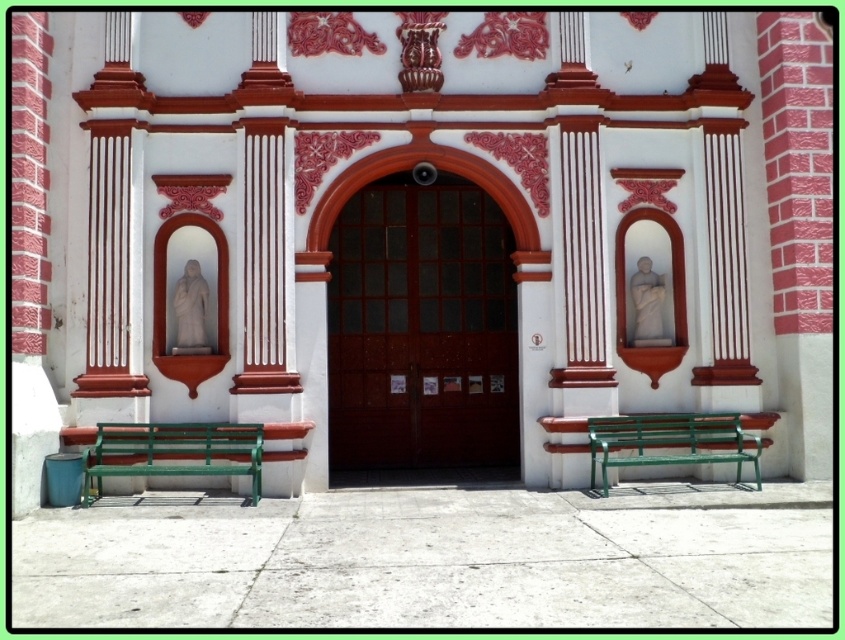
Does green painted wood bench at lower left have a smaller size compared to green metal bench at lower right?

Yes, green painted wood bench at lower left is smaller than green metal bench at lower right.

Does point (172, 460) come behind point (602, 449)?

That is True.

Does point (99, 454) come closer to viewer compared to point (701, 458)?

That is True.

Find the location of a particular element. green painted wood bench at lower left is located at coordinates (172, 452).